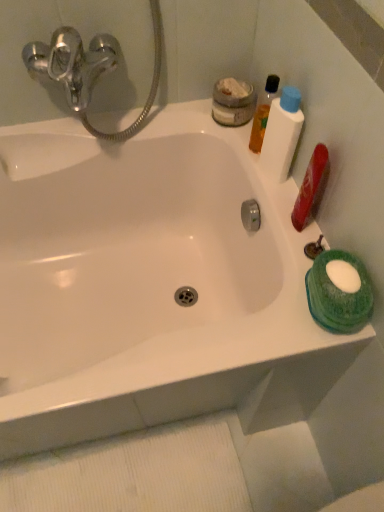
Question: Based on their sizes in the image, would you say translucent orange liquid at upper right, which is counted as the fourth mouthwash, starting from the bottom, is bigger or smaller than matte gray jar at upper right, placed as the first mouthwash when sorted from top to bottom?

Choices:
 (A) small
 (B) big

Answer: (A)

Question: Is translucent orange liquid at upper right, the second mouthwash positioned from the top, wider or thinner than matte gray jar at upper right, placed as the first mouthwash when sorted from top to bottom?

Choices:
 (A) thin
 (B) wide

Answer: (A)

Question: Which object is the closest to the green sponge at right, which appears as the 5th mouthwash when viewed from the top?

Choices:
 (A) matte gray jar at upper right, placed as the first mouthwash when sorted from top to bottom
 (B) red matte bottle at right, placed as the fourth mouthwash when sorted from top to bottom
 (C) white plastic bottle at upper right, which appears as the 3th mouthwash when viewed from the top
 (D) translucent orange liquid at upper right, which is counted as the fourth mouthwash, starting from the bottom

Answer: (B)

Question: Considering the real-world distances, which object is closest to the red matte bottle at right, which is counted as the second mouthwash, starting from the bottom?

Choices:
 (A) white plastic bottle at upper right, which appears as the 3th mouthwash when viewed from the top
 (B) matte gray jar at upper right, placed as the first mouthwash when sorted from top to bottom
 (C) translucent orange liquid at upper right, the second mouthwash positioned from the top
 (D) green sponge at right, which appears as the 5th mouthwash when viewed from the top

Answer: (A)